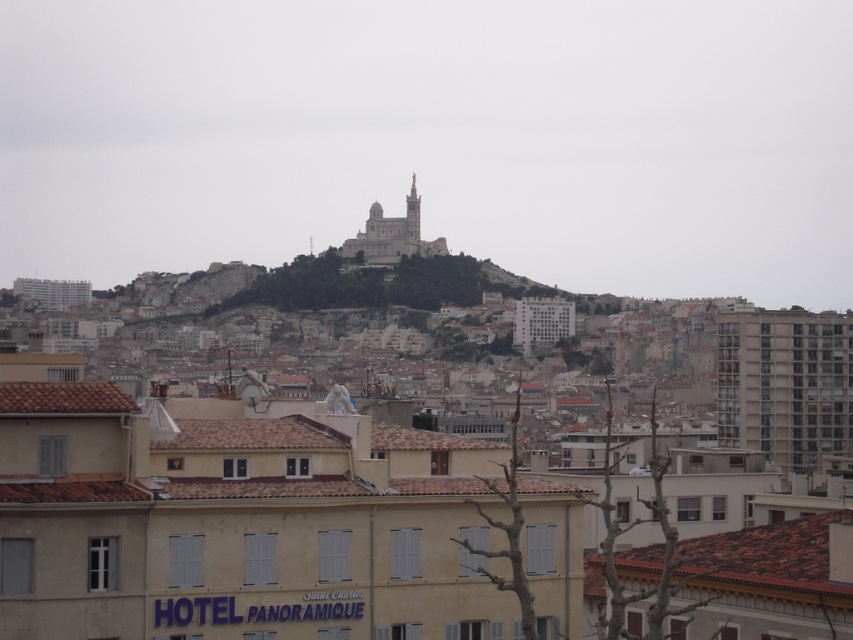
You are a drone operator tasked with capturing aerial footage of the city. Your drone has a maximum flight range of 1,000 feet from its starting position. If you take off from the gray concrete building at right, can your drone reach the white stone church at upper center without exceeding its range?

The distance between the gray concrete building at right and the white stone church at upper center is 924.91 feet, which is within the drone operator drone operator maximum flight range of 1,000 feet. Therefore, the drone can safely reach the white stone church at upper center without exceeding its range.

Looking at this image, you are a tourist in Marseille and want to take a photo of the white stone church at upper center without any obstructions. Is the gray concrete building at right blocking your view of the church?

The gray concrete building at right is located below the white stone church at upper center, so it will not block your view of the church.

You are standing at the point in the cityscape image at coordinates point (785, 385). What type of building are you in front of?

You are in front of a gray concrete building at right.